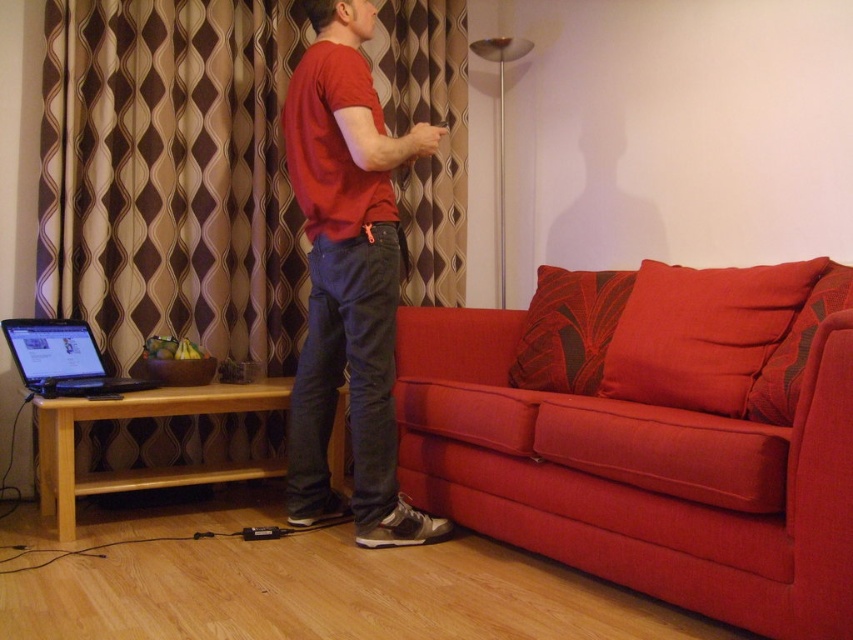
Question: Which point appears closest to the camera in this image?

Choices:
 (A) (306, 336)
 (B) (59, 125)

Answer: (A)

Question: Can you confirm if red fabric couch at lower right is positioned above matte red t-shirt at center?

Choices:
 (A) no
 (B) yes

Answer: (A)

Question: Which of the following is the closest to the observer?

Choices:
 (A) (647, 547)
 (B) (341, 321)
 (C) (173, 83)

Answer: (A)

Question: Among these objects, which one is nearest to the camera?

Choices:
 (A) red fabric couch at lower right
 (B) brown textured curtain at upper left

Answer: (A)

Question: Can you confirm if red fabric couch at lower right is thinner than brown textured curtain at upper left?

Choices:
 (A) no
 (B) yes

Answer: (A)

Question: Does red fabric couch at lower right have a greater width compared to brown textured curtain at upper left?

Choices:
 (A) yes
 (B) no

Answer: (A)